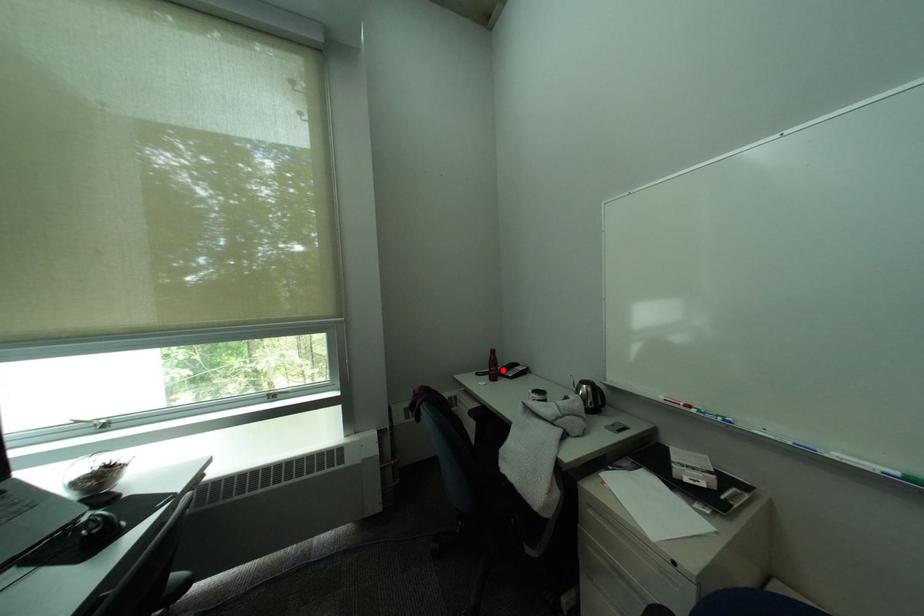
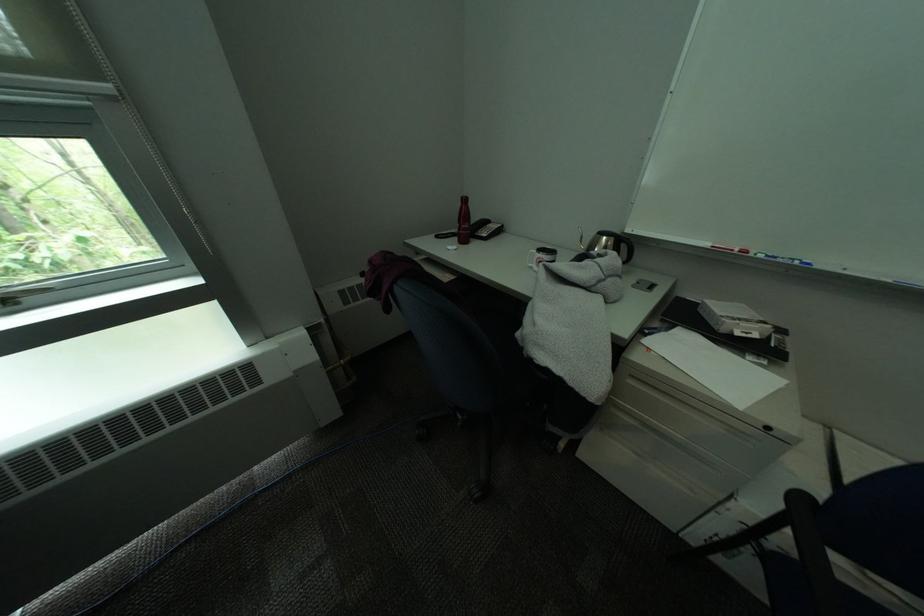
Question: I am providing you with two images of the same scene from different viewpoints. Given a red point in image1, look at the same physical point in image2. Is it:

Choices:
 (A) Closer to the viewpoint
 (B) Farther from the viewpoint

Answer: (A)